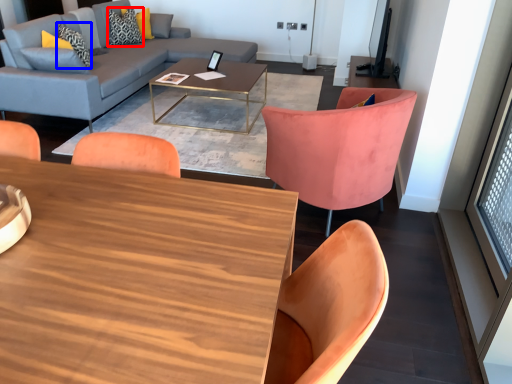
Question: Which point is further to the camera, pillow (highlighted by a red box) or pillow (highlighted by a blue box)?

Choices:
 (A) pillow
 (B) pillow

Answer: (A)